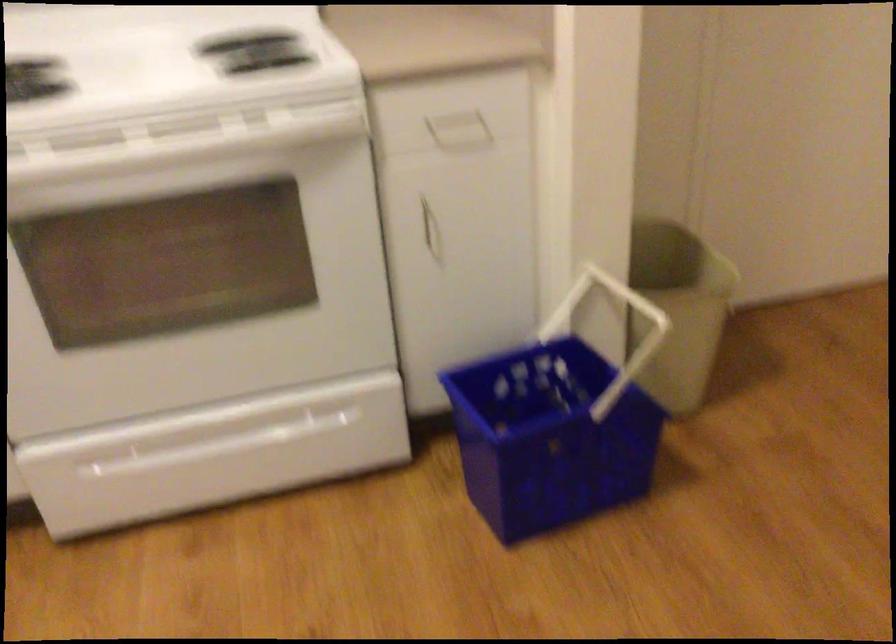
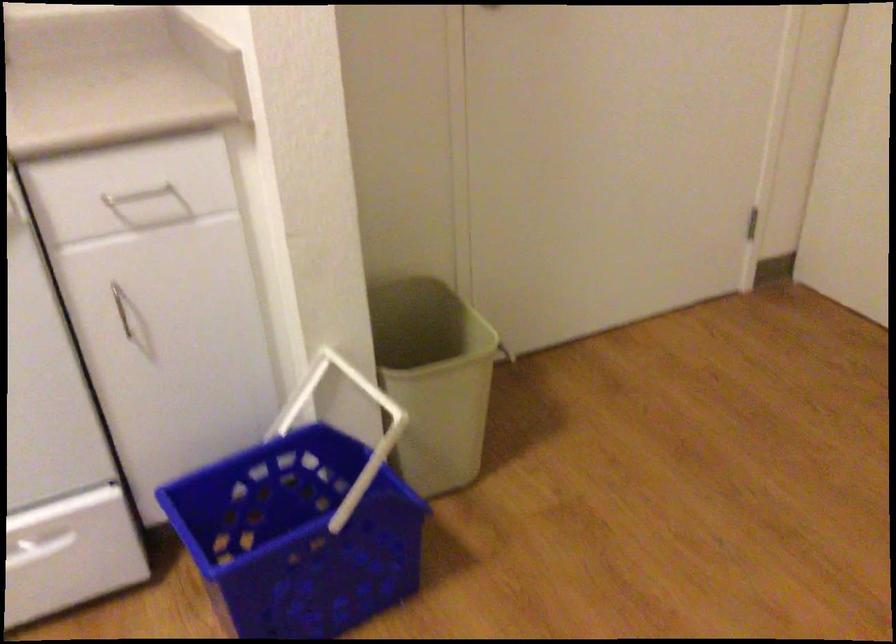
In a continuous first-person perspective shot, in which direction is the camera moving?

The cameraman moved toward right, forward.